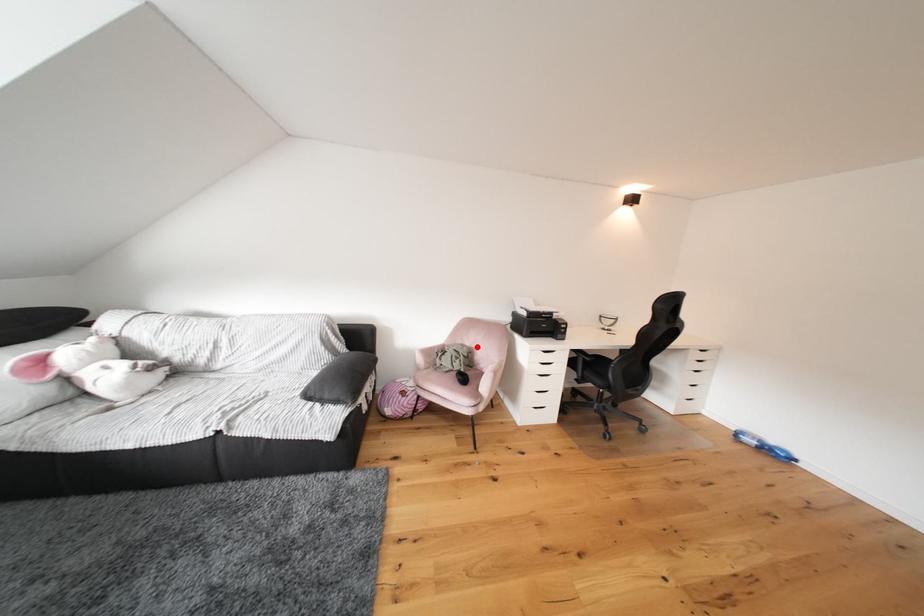
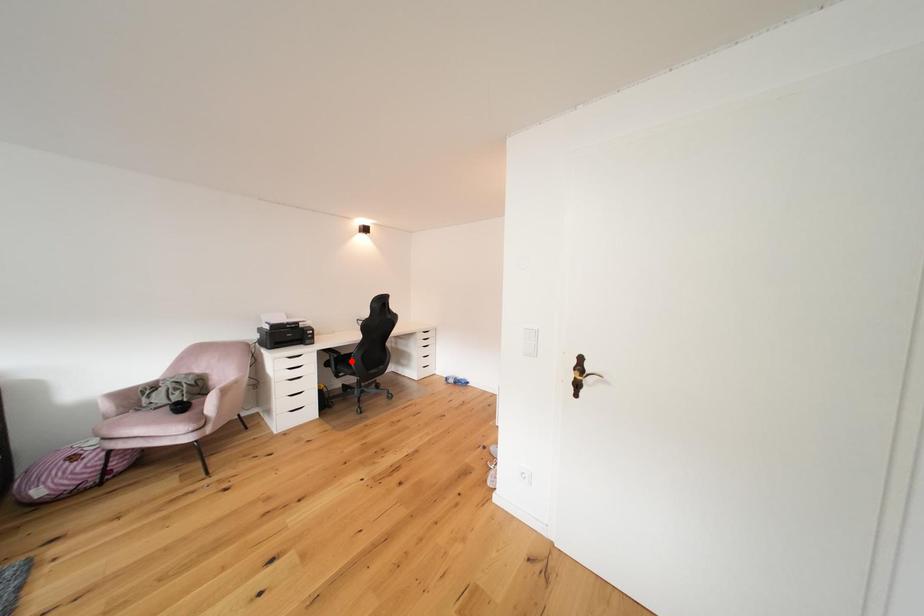
I am providing you with two images of the same scene from different viewpoints. A red point is marked on the first image and another point is marked on the second image. Do the highlighted points in image1 and image2 indicate the same real-world spot?

No